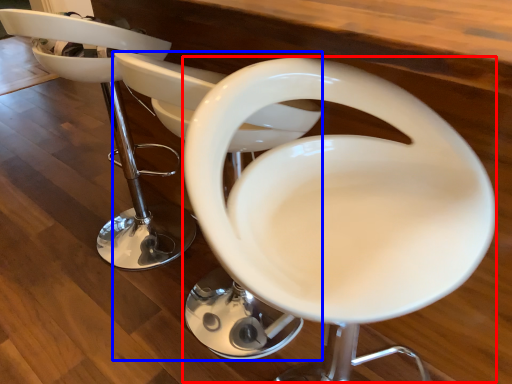
Question: Which point is further to the camera, feeding chair (highlighted by a red box) or feeding chair (highlighted by a blue box)?

Choices:
 (A) feeding chair
 (B) feeding chair

Answer: (B)